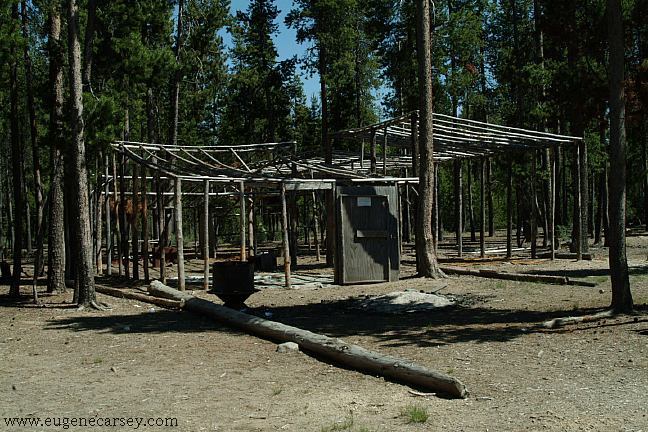
The height and width of the screenshot is (432, 648). Identify the location of white sign on wooden wall. (364, 201).